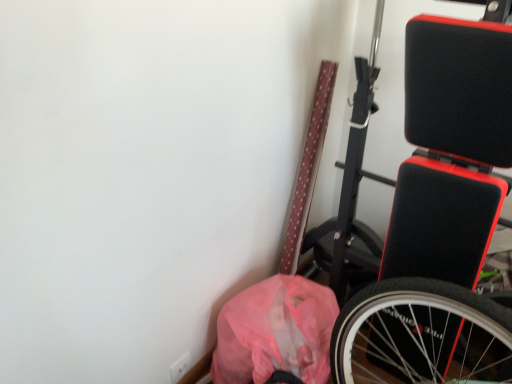
This screenshot has height=384, width=512. What do you see at coordinates (275, 332) in the screenshot?
I see `pink plastic bag at lower right` at bounding box center [275, 332].

The image size is (512, 384). What are the coordinates of `pink plastic bag at lower right` in the screenshot? It's located at (275, 332).

What is the approximate height of black matte exercise bench at right?

The height of black matte exercise bench at right is 1.24 meters.

Identify the location of black matte exercise bench at right. The image size is (512, 384). (451, 149).

This screenshot has height=384, width=512. What do you see at coordinates (451, 149) in the screenshot? I see `black matte exercise bench at right` at bounding box center [451, 149].

This screenshot has height=384, width=512. What are the coordinates of `pink plastic bag at lower right` in the screenshot? It's located at (275, 332).

Which is more to the left, pink plastic bag at lower right or black matte exercise bench at right?

pink plastic bag at lower right.

Which object is more forward, pink plastic bag at lower right or black matte exercise bench at right?

Positioned in front is black matte exercise bench at right.

Is point (234, 305) closer to camera compared to point (477, 244)?

No, it is behind (477, 244).

From the image's perspective, between pink plastic bag at lower right and black matte exercise bench at right, which one is located above?

black matte exercise bench at right.

From a real-world perspective, is pink plastic bag at lower right physically located above or below black matte exercise bench at right?

In terms of real-world spatial position, pink plastic bag at lower right is below black matte exercise bench at right.

Between pink plastic bag at lower right and black matte exercise bench at right, which one has larger width?

With larger width is black matte exercise bench at right.

Does pink plastic bag at lower right have a lesser height compared to black matte exercise bench at right?

Indeed, pink plastic bag at lower right has a lesser height compared to black matte exercise bench at right.

Considering the sizes of objects pink plastic bag at lower right and black matte exercise bench at right in the image provided, who is smaller, pink plastic bag at lower right or black matte exercise bench at right?

With smaller size is pink plastic bag at lower right.

Choose the correct answer: Is pink plastic bag at lower right inside black matte exercise bench at right or outside it?

pink plastic bag at lower right is not inside black matte exercise bench at right, it's outside.

Can you see pink plastic bag at lower right touching black matte exercise bench at right?

pink plastic bag at lower right is not next to black matte exercise bench at right, and they're not touching.

Is black matte exercise bench at right at the back of pink plastic bag at lower right?

That's not correct — pink plastic bag at lower right is not looking away from black matte exercise bench at right.

Can you tell me how much pink plastic bag at lower right and black matte exercise bench at right differ in facing direction?

87.3 degrees separate the facing orientations of pink plastic bag at lower right and black matte exercise bench at right.

At what (x,y) coordinates should I click in order to perform the action: click on material on the left of black matte exercise bench at right. Please return your answer as a coordinate pair (x, y). Looking at the image, I should click on (275, 332).

Can you confirm if black matte exercise bench at right is positioned to the right of pink plastic bag at lower right?

Indeed, black matte exercise bench at right is positioned on the right side of pink plastic bag at lower right.

Is black matte exercise bench at right further to camera compared to pink plastic bag at lower right?

No, it is not.

Is point (370, 334) closer or farther from the camera than point (310, 311)?

Clearly, point (370, 334) is more distant from the camera than point (310, 311).

From the image's perspective, would you say black matte exercise bench at right is positioned over pink plastic bag at lower right?

Yes, from the image's perspective, black matte exercise bench at right is on top of pink plastic bag at lower right.

From a real-world perspective, relative to pink plastic bag at lower right, is black matte exercise bench at right vertically above or below?

From a real-world perspective, black matte exercise bench at right is physically above pink plastic bag at lower right.

Considering the sizes of objects black matte exercise bench at right and pink plastic bag at lower right in the image provided, who is wider, black matte exercise bench at right or pink plastic bag at lower right?

black matte exercise bench at right.

Is black matte exercise bench at right taller or shorter than pink plastic bag at lower right?

Clearly, black matte exercise bench at right is taller compared to pink plastic bag at lower right.

Considering the sizes of objects black matte exercise bench at right and pink plastic bag at lower right in the image provided, who is bigger, black matte exercise bench at right or pink plastic bag at lower right?

With larger size is black matte exercise bench at right.

Is black matte exercise bench at right not within pink plastic bag at lower right?

black matte exercise bench at right lies outside pink plastic bag at lower right's area.

Can you see black matte exercise bench at right touching pink plastic bag at lower right?

No.

Could you tell me if black matte exercise bench at right is turned towards pink plastic bag at lower right?

No, black matte exercise bench at right is not aimed at pink plastic bag at lower right.

The width and height of the screenshot is (512, 384). I want to click on material that appears below the black matte exercise bench at right (from the image's perspective), so click(x=275, y=332).

Find the location of a particular element. Image resolution: width=512 pixels, height=384 pixels. wide located in front of the pink plastic bag at lower right is located at coordinates (451, 149).

The image size is (512, 384). I want to click on wide lying on the right of pink plastic bag at lower right, so click(451, 149).